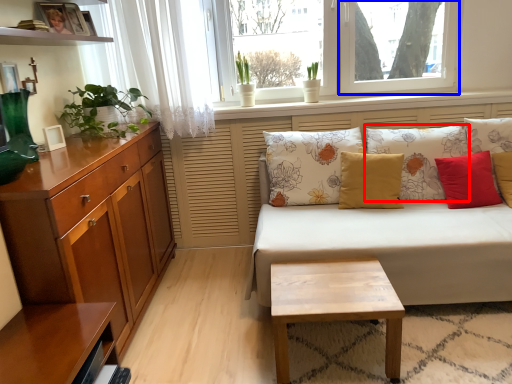
Question: Which of the following is the closest to the observer, pillow (highlighted by a red box) or window screen (highlighted by a blue box)?

Choices:
 (A) pillow
 (B) window screen

Answer: (A)